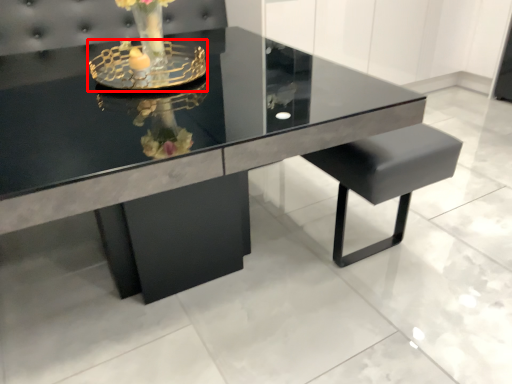
Question: From the image's perspective, where is candle holder (annotated by the red box) located relative to table?

Choices:
 (A) below
 (B) above

Answer: (B)